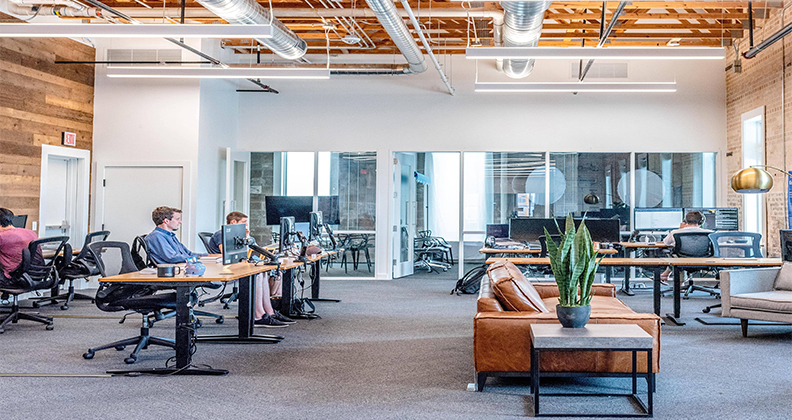
Where is `couch`? couch is located at coordinates (524, 302), (756, 297).